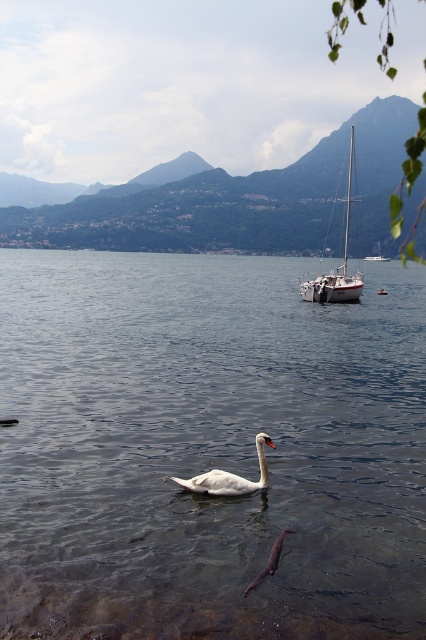
Between white glossy sailboat at upper right and shiny purple fish at lower center, which one is positioned lower?

shiny purple fish at lower center is lower down.

Which is more to the left, white glossy sailboat at upper right or shiny purple fish at lower center?

From the viewer's perspective, shiny purple fish at lower center appears more on the left side.

Which is behind, point (351, 289) or point (259, 580)?

Positioned behind is point (351, 289).

The image size is (426, 640). What are the coordinates of `white glossy sailboat at upper right` in the screenshot? It's located at (337, 266).

Consider the image. Can you confirm if white glossy swan at center is bigger than shiny purple fish at lower center?

Correct, white glossy swan at center is larger in size than shiny purple fish at lower center.

Does white glossy swan at center have a smaller size compared to shiny purple fish at lower center?

No, white glossy swan at center is not smaller than shiny purple fish at lower center.

Is point (190, 483) positioned after point (258, 579)?

Yes.

Where is `white glossy swan at center`? The width and height of the screenshot is (426, 640). white glossy swan at center is located at coordinates (230, 476).

Is shiny purple fish at lower center smaller than white glossy sailboat at center?

Correct, shiny purple fish at lower center occupies less space than white glossy sailboat at center.

Which is below, shiny purple fish at lower center or white glossy sailboat at center?

shiny purple fish at lower center

Is point (267, 572) closer to camera compared to point (386, 259)?

Yes.

This screenshot has width=426, height=640. Find the location of `shiny purple fish at lower center`. shiny purple fish at lower center is located at coordinates (270, 561).